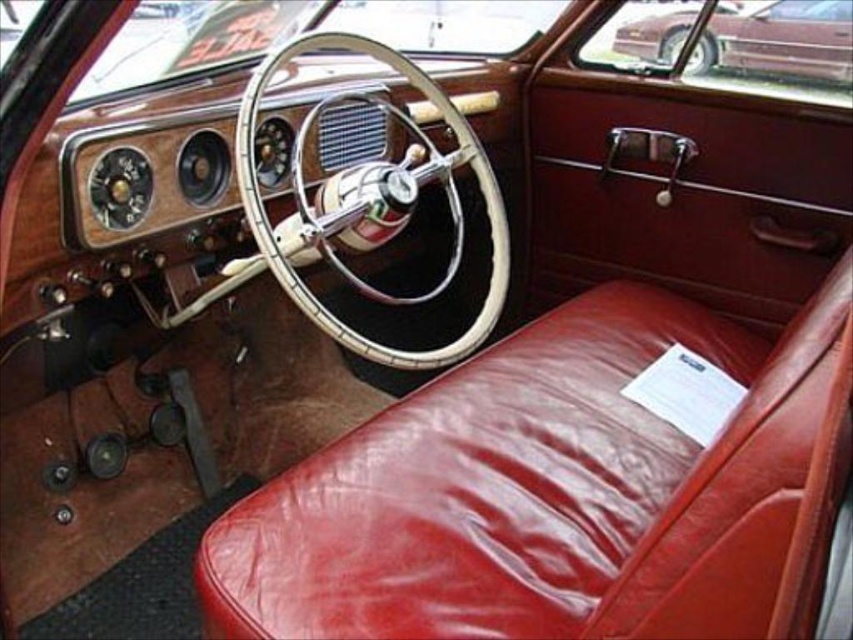
Question: Which point appears closest to the camera in this image?

Choices:
 (A) pos(543,536)
 (B) pos(820,17)

Answer: (A)

Question: Can you confirm if shiny leather seat at center is bigger than shiny maroon sedan at upper right?

Choices:
 (A) yes
 (B) no

Answer: (A)

Question: Which object is closer to the camera taking this photo?

Choices:
 (A) shiny leather seat at center
 (B) shiny maroon sedan at upper right

Answer: (A)

Question: Is shiny leather seat at center further to the viewer compared to shiny maroon sedan at upper right?

Choices:
 (A) yes
 (B) no

Answer: (B)

Question: Does shiny leather seat at center appear under shiny maroon sedan at upper right?

Choices:
 (A) yes
 (B) no

Answer: (A)

Question: Among these points, which one is nearest to the camera?

Choices:
 (A) (280, 536)
 (B) (705, 48)

Answer: (A)